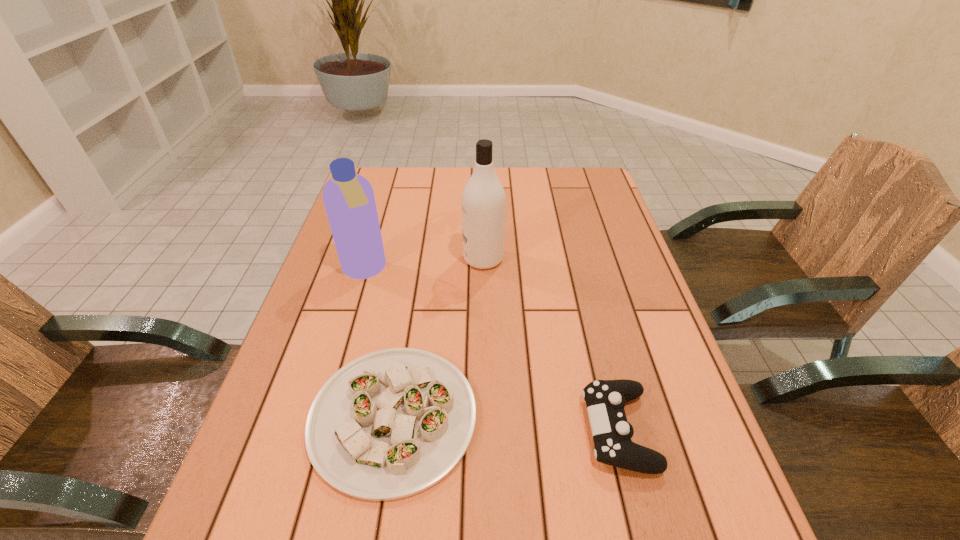
Identify which object is the second closest to the left shampoo. Please provide its 2D coordinates. Your answer should be formatted as a tuple, i.e. [(x, y)], where the tuple contains the x and y coordinates of a point satisfying the conditions above.

[(483, 199)]